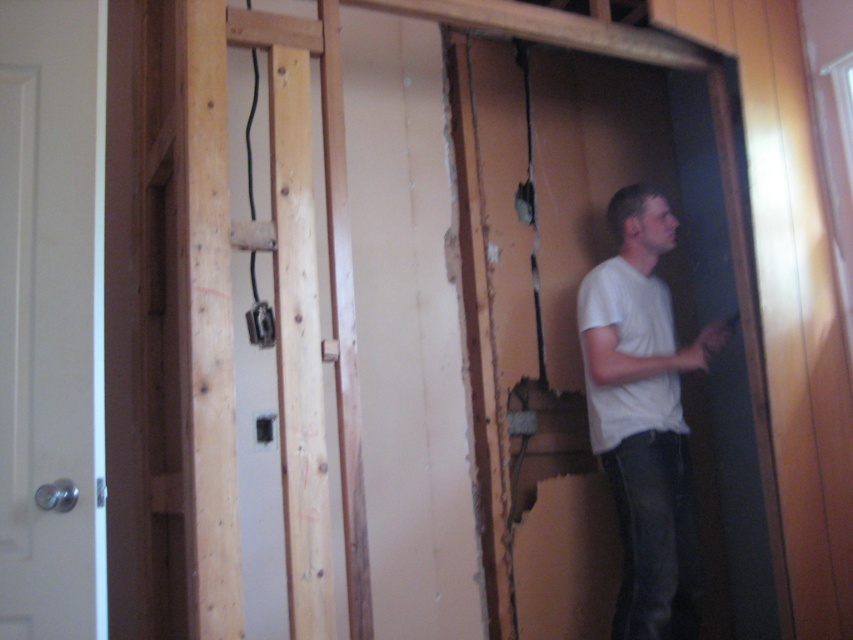
Does white matte door at left have a smaller size compared to white cotton shirt at right?

Indeed, white matte door at left has a smaller size compared to white cotton shirt at right.

Is point (56, 244) more distant than point (595, 452)?

That is False.

Where is `white matte door at left`? The height and width of the screenshot is (640, 853). white matte door at left is located at coordinates (51, 317).

Can you confirm if white cotton shirt at right is taller than white matte shirt at center?

Indeed, white cotton shirt at right has a greater height compared to white matte shirt at center.

Which is behind, point (625, 189) or point (648, 298)?

Positioned behind is point (625, 189).

Is point (642, 333) farther from camera compared to point (674, 412)?

No, it is in front of (674, 412).

Identify the location of white cotton shirt at right. (643, 417).

Does white matte door at left have a larger size compared to white matte shirt at center?

No.

Does white matte door at left appear on the left side of white matte shirt at center?

Indeed, white matte door at left is positioned on the left side of white matte shirt at center.

Locate an element on the screen. Image resolution: width=853 pixels, height=640 pixels. white matte door at left is located at coordinates (51, 317).

Where is `white matte door at left`? white matte door at left is located at coordinates (51, 317).